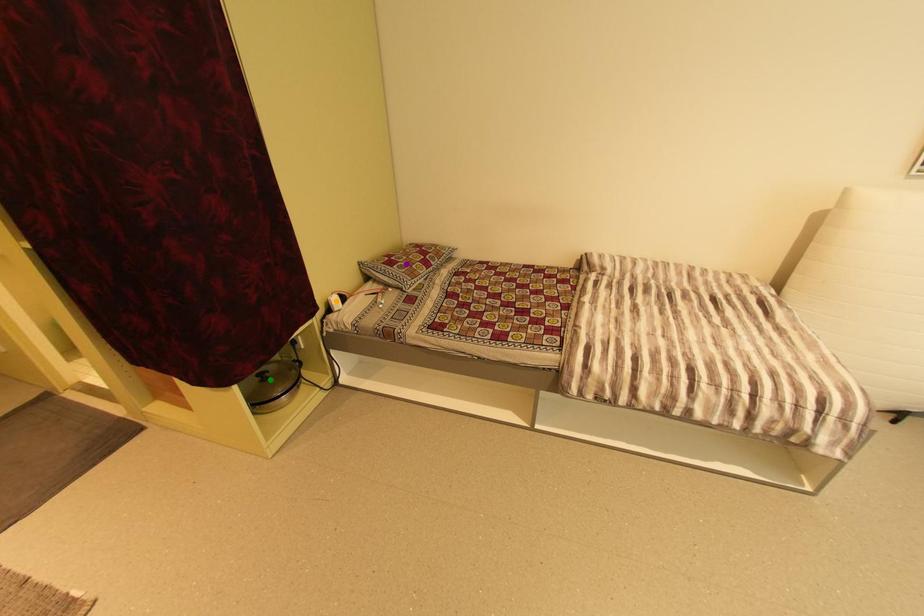
Order these from nearest to farthest:
1. orange point
2. green point
3. purple point

green point < orange point < purple point